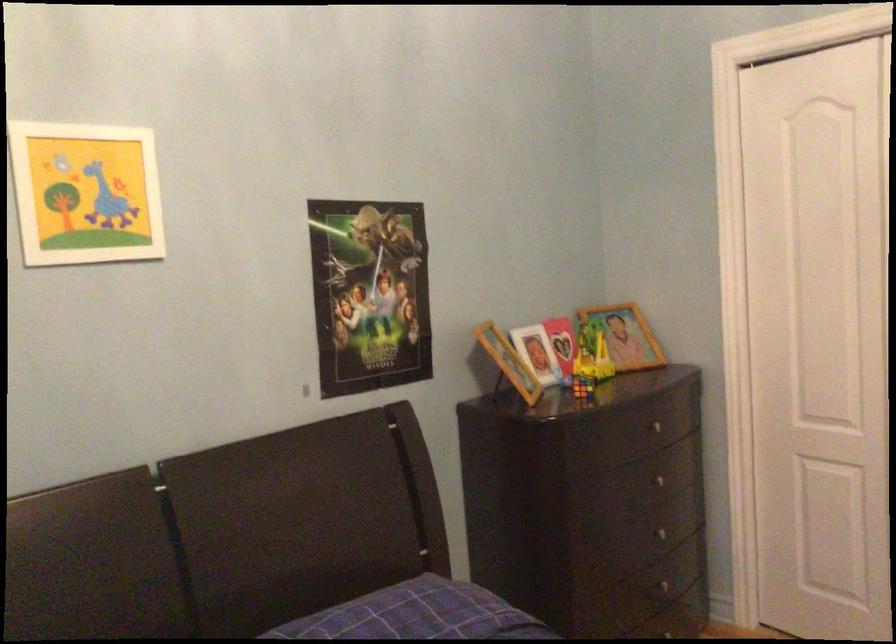
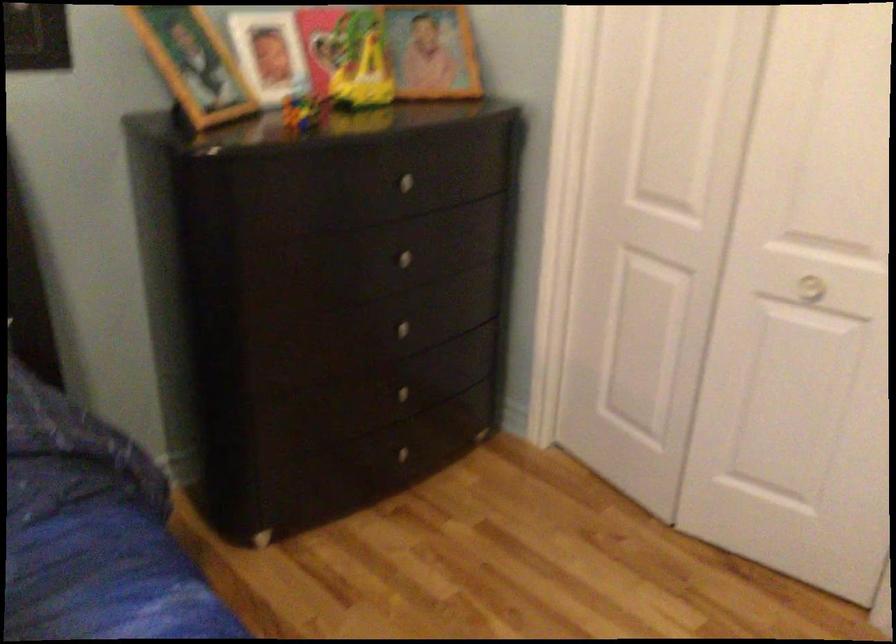
Where in the second image is the point corresponding to point 659,484 from the first image?

(399, 258)